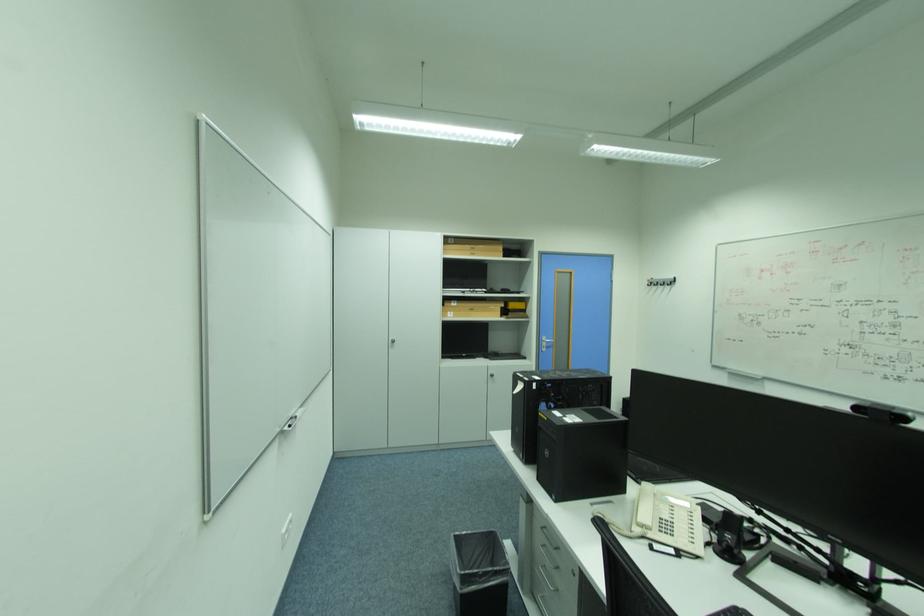
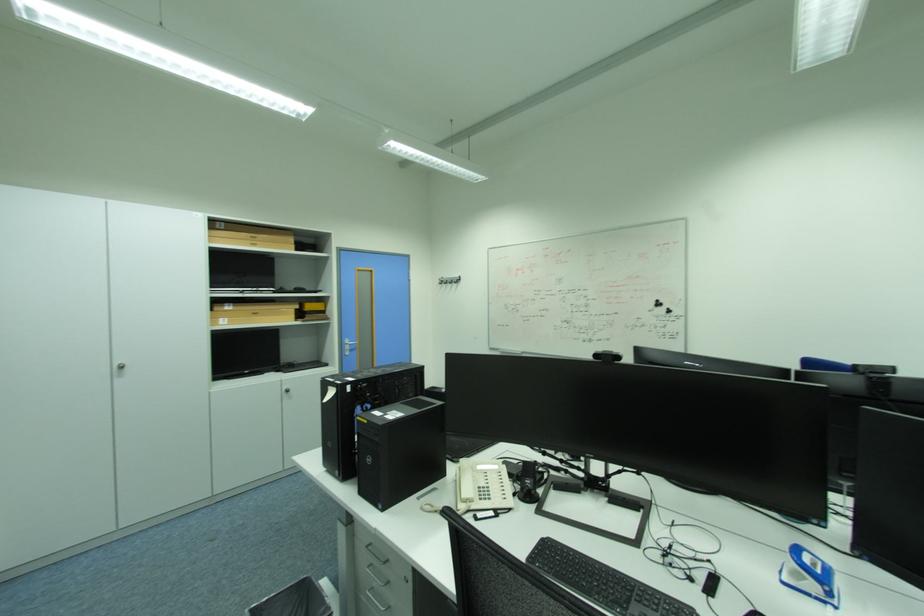
Where in the second image is the point corresponding to (x=480, y=254) from the first image?

(261, 246)